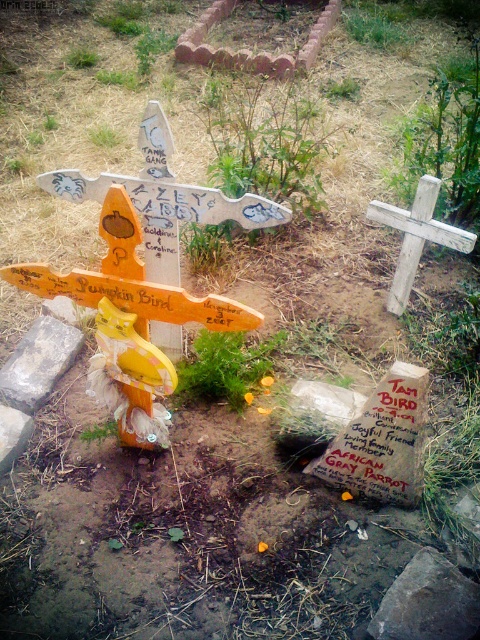
Question: Which point is farther from the camera taking this photo?

Choices:
 (A) (24, 413)
 (B) (437, 612)

Answer: (A)

Question: Is wooden cross at center to the right of weathered wood cross at upper right from the viewer's perspective?

Choices:
 (A) yes
 (B) no

Answer: (B)

Question: Which point is closer to the camera taking this photo?

Choices:
 (A) (64, 326)
 (B) (386, 593)

Answer: (B)

Question: Does weathered wood cross at upper right have a smaller size compared to smooth gray stone at lower left?

Choices:
 (A) no
 (B) yes

Answer: (A)

Question: Can you confirm if smooth gray rock at lower right is smaller than smooth gray stone at lower left?

Choices:
 (A) no
 (B) yes

Answer: (A)

Question: Estimate the real-world distances between objects in this image. Which object is closer to the smooth gray stone at lower left?

Choices:
 (A) smooth gray rock at lower right
 (B) gray stone at lower left

Answer: (B)